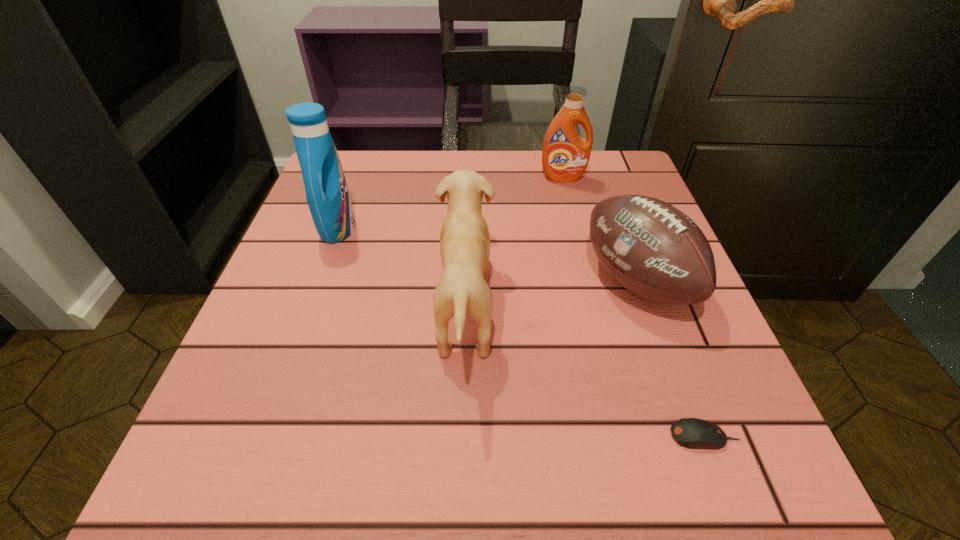
Find the location of a particular element. The width and height of the screenshot is (960, 540). free space that is in between the tallest object and the puppy is located at coordinates (401, 269).

Where is `free spot between the puppy and the second shortest object`? free spot between the puppy and the second shortest object is located at coordinates (551, 295).

The width and height of the screenshot is (960, 540). Find the location of `free spot between the computer mouse and the second object from left to right`. free spot between the computer mouse and the second object from left to right is located at coordinates (585, 373).

At what (x,y) coordinates should I click in order to perform the action: click on vacant area between the shortest object and the right detergent. Please return your answer as a coordinate pair (x, y). The image size is (960, 540). Looking at the image, I should click on (634, 307).

Identify the location of vacant area between the puppy and the farther detergent. (514, 244).

The image size is (960, 540). In order to click on vacant space that's between the right detergent and the computer mouse in this screenshot , I will do `click(634, 307)`.

I want to click on free space between the puppy and the computer mouse, so click(585, 373).

The image size is (960, 540). Find the location of `object that is the closest to the left detergent`. object that is the closest to the left detergent is located at coordinates (464, 238).

Select which object is the third closest to the second shortest object. Please provide its 2D coordinates. Your answer should be formatted as a tuple, i.e. [(x, y)], where the tuple contains the x and y coordinates of a point satisfying the conditions above.

[(565, 155)]

I want to click on free space that satisfies the following two spatial constraints: 1. on the front-facing side of the farther detergent; 2. on the front-facing side of the nearer detergent, so click(575, 228).